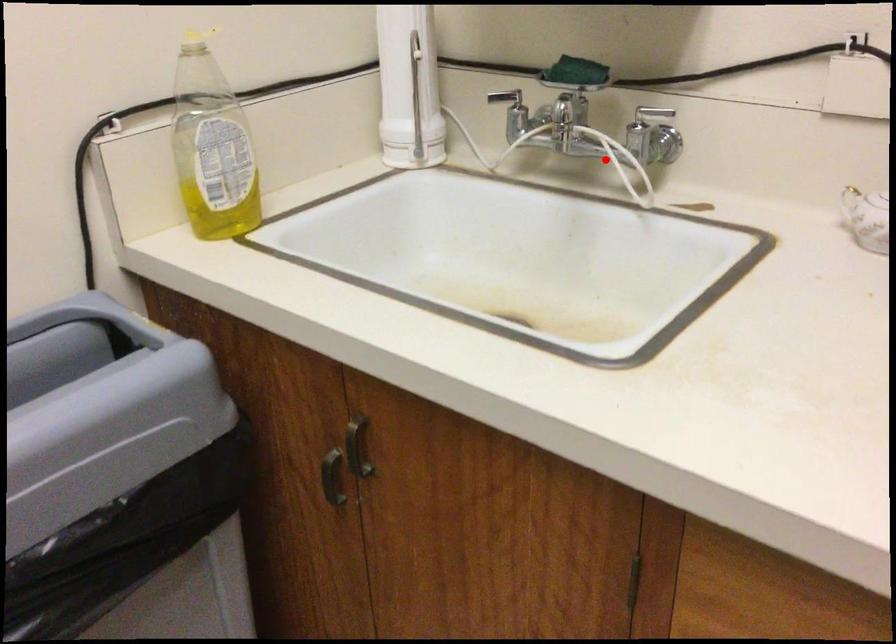
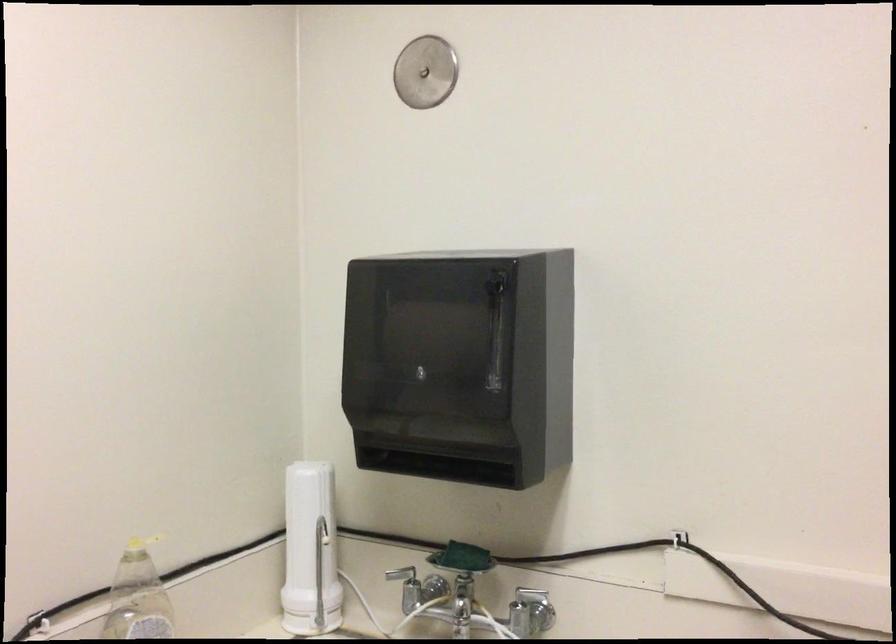
Question: I am providing you with two images of the same scene from different viewpoints. A red point is shown in image1. For the corresponding object point in image2, is it positioned nearer or farther from the camera?

Choices:
 (A) Nearer
 (B) Farther

Answer: (B)